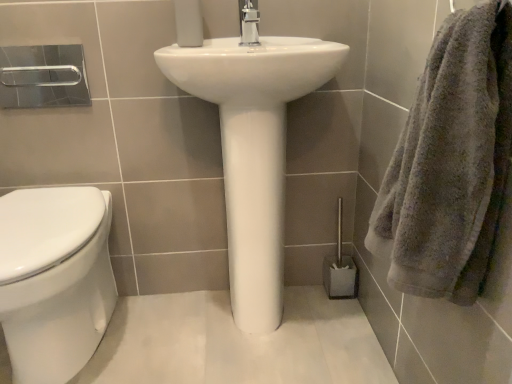
Identify the location of free location to the right of white glossy toilet at left. The width and height of the screenshot is (512, 384). (168, 344).